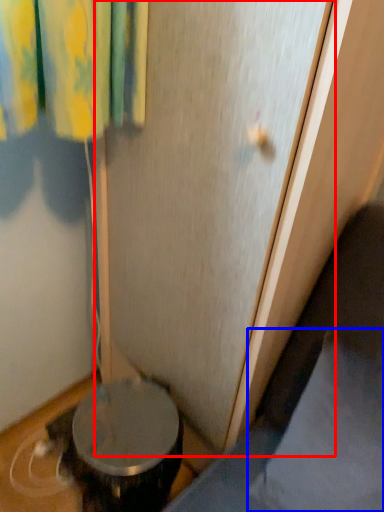
Question: Which point is closer to the camera, screen door (highlighted by a red box) or pillow (highlighted by a blue box)?

Choices:
 (A) screen door
 (B) pillow

Answer: (A)